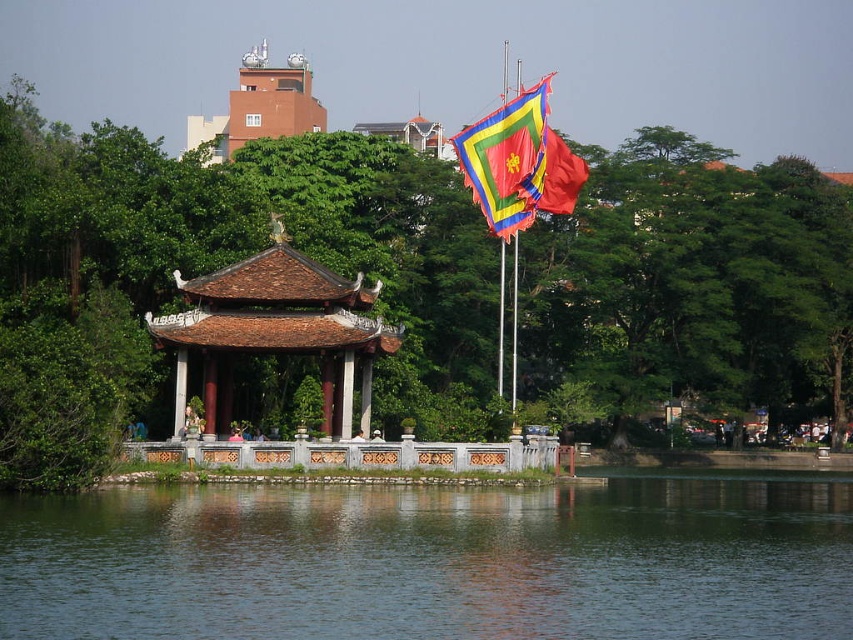
Question: Is matte orange temple at upper center bigger than red fabric flag at upper center?

Choices:
 (A) no
 (B) yes

Answer: (B)

Question: Based on their relative distances, which object is farther from the matte orange temple at upper center?

Choices:
 (A) shiny silk flag at upper center
 (B) green leafy tree at center
 (C) green smooth water at center
 (D) red fabric flag at upper center

Answer: (C)

Question: Does shiny silk flag at upper center appear on the left side of red fabric flag at upper center?

Choices:
 (A) yes
 (B) no

Answer: (A)

Question: In this image, where is brown tiled gazebo at center located relative to shiny silk flag at upper center?

Choices:
 (A) right
 (B) left

Answer: (B)

Question: Based on their relative distances, which object is farther from the matte orange temple at upper center?

Choices:
 (A) red fabric flag at upper center
 (B) shiny silk flag at upper center
 (C) green smooth water at center

Answer: (C)

Question: Which point is closer to the camera taking this photo?

Choices:
 (A) (519, 195)
 (B) (263, 51)
 (C) (311, 428)

Answer: (C)